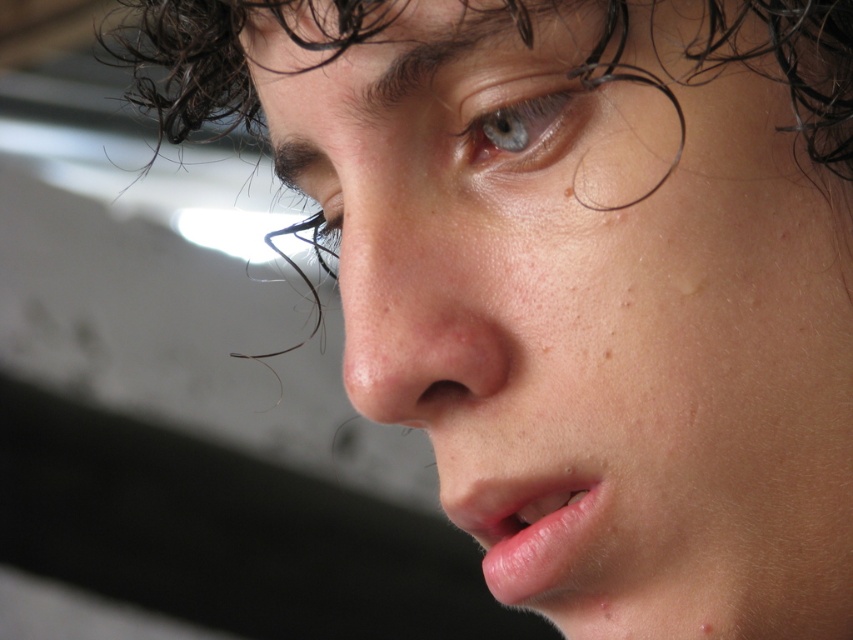
Is smooth skin face at center thinner than pink glossy lips at lower center?

No, smooth skin face at center is not thinner than pink glossy lips at lower center.

Which is below, smooth skin face at center or pink glossy lips at lower center?

Positioned lower is pink glossy lips at lower center.

Who is more forward, (822,339) or (451,508)?

Positioned in front is point (822,339).

I want to click on smooth skin face at center, so click(x=593, y=312).

Measure the distance between point (163, 112) and camera.

Point (163, 112) is 3.71 feet away from camera.

Who is more forward, (x=596, y=54) or (x=552, y=90)?

Point (x=596, y=54)

Locate an element on the screen. Image resolution: width=853 pixels, height=640 pixels. dark curly hair at upper center is located at coordinates (227, 52).

Does dark curly hair at upper center have a smaller size compared to brown matte freckle at lower right?

Actually, dark curly hair at upper center might be larger than brown matte freckle at lower right.

Where is `dark curly hair at upper center`? The width and height of the screenshot is (853, 640). dark curly hair at upper center is located at coordinates [x=227, y=52].

The width and height of the screenshot is (853, 640). What are the coordinates of `dark curly hair at upper center` in the screenshot? It's located at (227, 52).